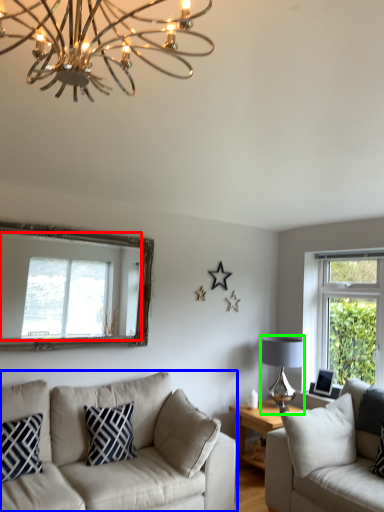
Question: Which is nearer to the window (highlighted by a red box)? studio couch (highlighted by a blue box) or lamp (highlighted by a green box).

Choices:
 (A) studio couch
 (B) lamp

Answer: (A)